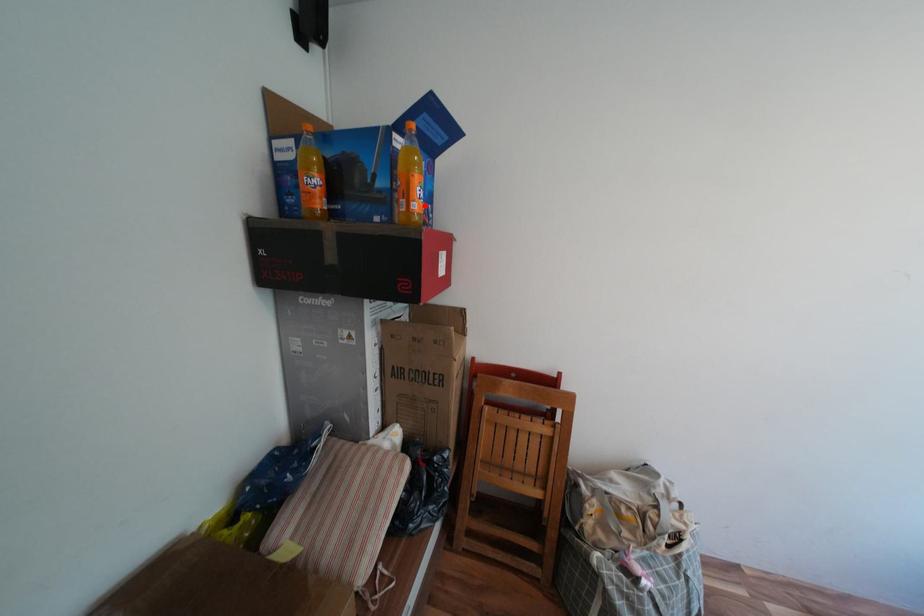
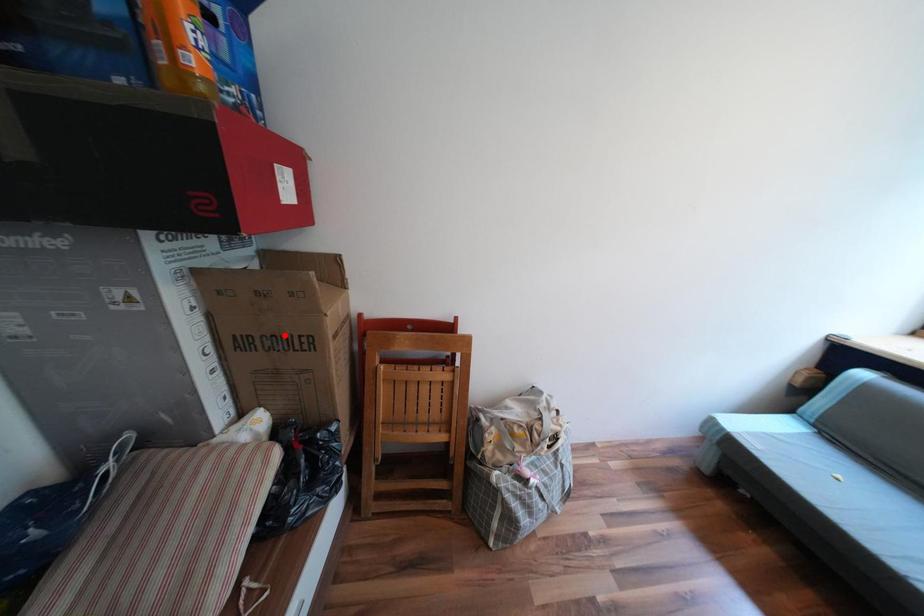
I am providing you with two images of the same scene from different viewpoints. A red point is marked on the first image and another point is marked on the second image. Is the red point in image1 aligned with the point shown in image2?

No